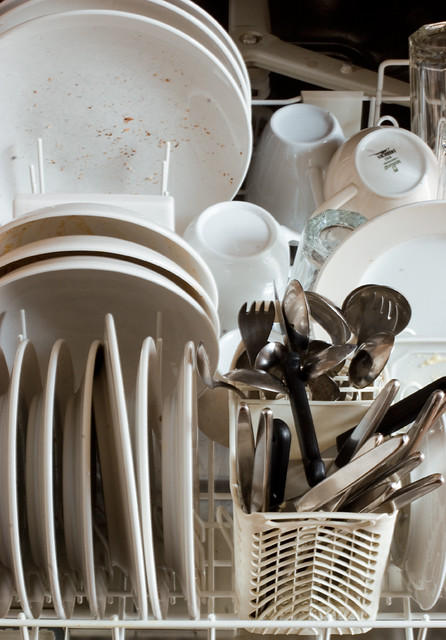
This screenshot has height=640, width=446. I want to click on plate edges, so click(x=186, y=452), click(x=144, y=397), click(x=124, y=427), click(x=86, y=454), click(x=48, y=468), click(x=13, y=464), click(x=175, y=36), click(x=174, y=10), click(x=198, y=9), click(x=364, y=224).